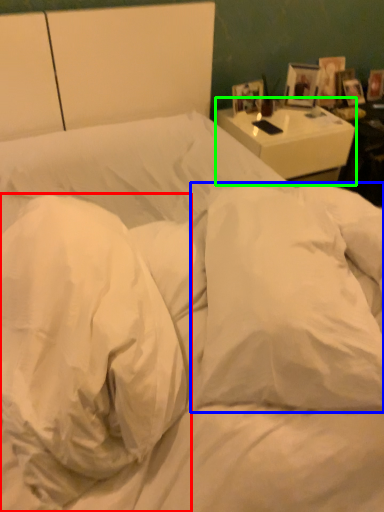
Question: Based on their relative distances, which object is farther from pillow (highlighted by a red box)? Choose from pillow (highlighted by a blue box) and nightstand (highlighted by a green box).

Choices:
 (A) pillow
 (B) nightstand

Answer: (B)